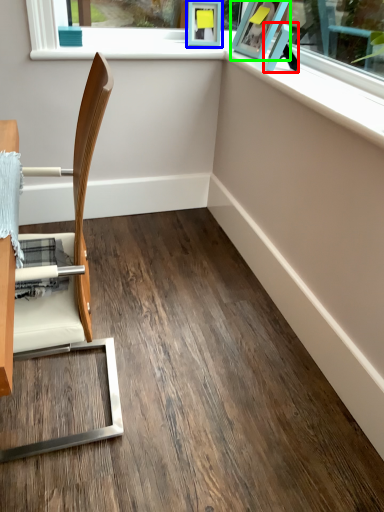
Question: Which object is positioned farthest from picture frame (highlighted by a red box)? Select from picture frame (highlighted by a blue box) and picture frame (highlighted by a green box).

Choices:
 (A) picture frame
 (B) picture frame

Answer: (A)